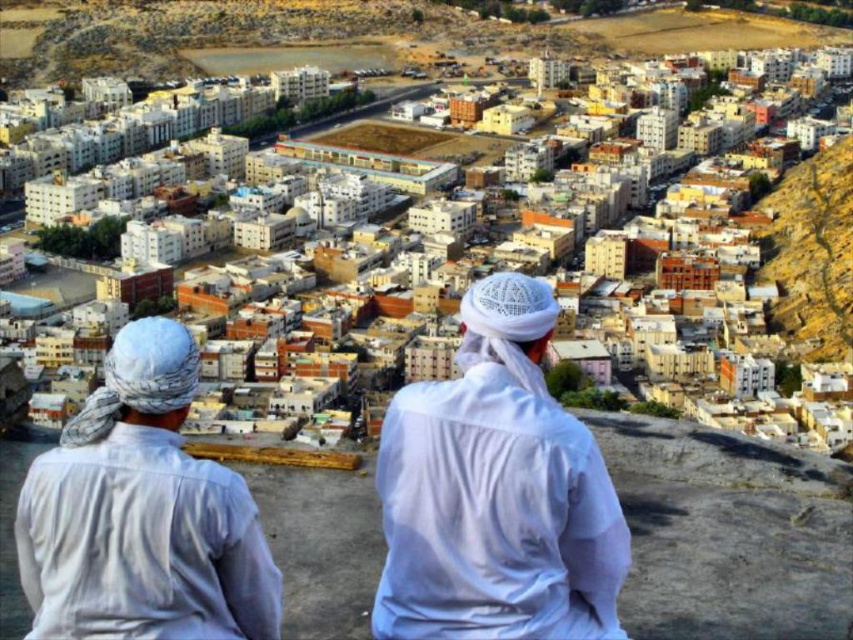
Question: Among these points, which one is farthest from the camera?

Choices:
 (A) (569, 436)
 (B) (28, 596)

Answer: (B)

Question: Can you confirm if white cotton clothing at center is positioned above white cotton robe at center?

Choices:
 (A) no
 (B) yes

Answer: (B)

Question: Which of these objects is positioned farthest from the white cotton clothing at center?

Choices:
 (A) white cotton robe at center
 (B) white cotton shirt at left

Answer: (B)

Question: Does white cotton clothing at center appear on the left side of white cotton robe at center?

Choices:
 (A) no
 (B) yes

Answer: (B)

Question: Is white cotton clothing at center above white cotton shirt at left?

Choices:
 (A) no
 (B) yes

Answer: (B)

Question: Which of these objects is positioned closest to the white cotton clothing at center?

Choices:
 (A) white cotton shirt at left
 (B) white cotton robe at center

Answer: (B)